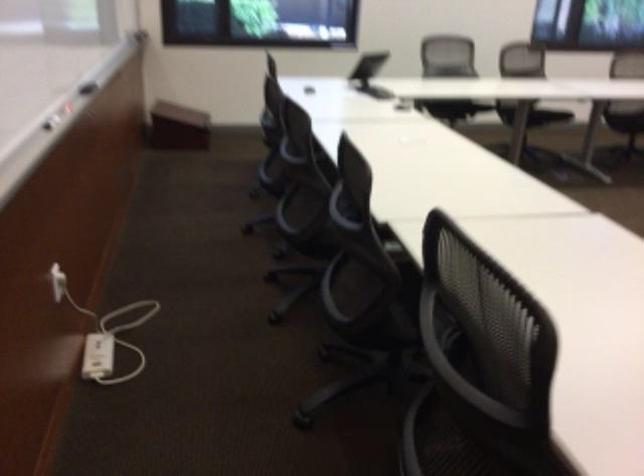
This screenshot has height=476, width=644. I want to click on closed black laptop, so click(x=368, y=72).